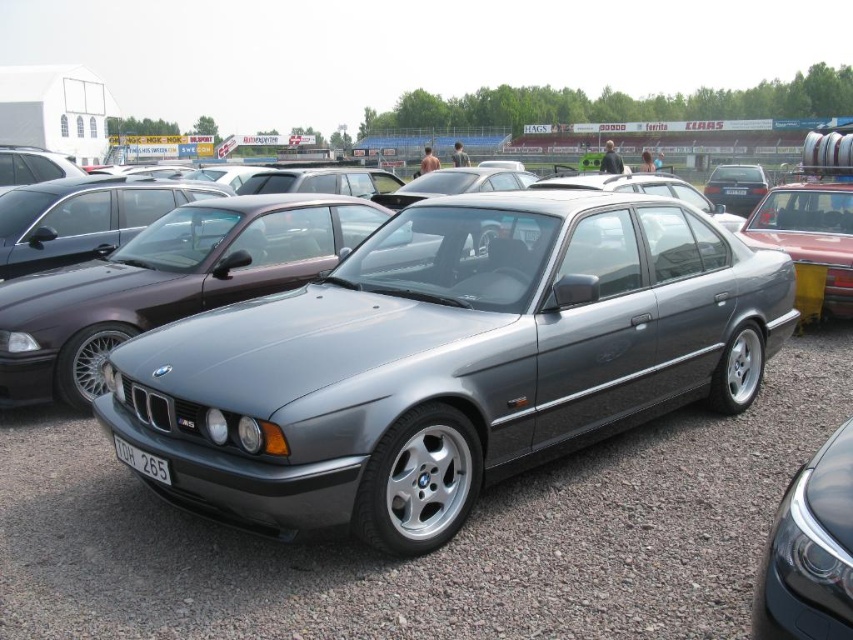
Question: Is satin silver car at center further to camera compared to satin black car at left?

Choices:
 (A) yes
 (B) no

Answer: (B)

Question: Which object is farther from the camera taking this photo?

Choices:
 (A) white plastic license plate at lower center
 (B) satin black car at left

Answer: (B)

Question: Which point is farther to the camera?

Choices:
 (A) (209, 417)
 (B) (169, 476)
 (C) (705, 195)
 (D) (805, 273)

Answer: (C)

Question: Is satin black car at left bigger than metallic silver sedan at right?

Choices:
 (A) yes
 (B) no

Answer: (A)

Question: Is satin metallic sedan at center bigger than satin black sedan at upper right?

Choices:
 (A) yes
 (B) no

Answer: (B)

Question: Which is nearer to the metallic silver sedan at right?

Choices:
 (A) white plastic license plate at lower center
 (B) satin black headlight at center
 (C) satin black sedan at upper right

Answer: (B)